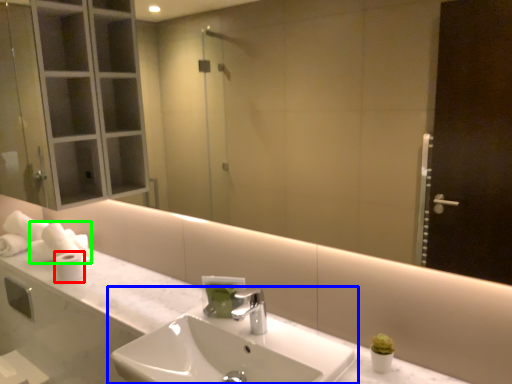
Question: Considering the real-world distances, which object is closest to toilet paper (highlighted by a red box)? sink (highlighted by a blue box) or toilet paper (highlighted by a green box).

Choices:
 (A) sink
 (B) toilet paper

Answer: (B)